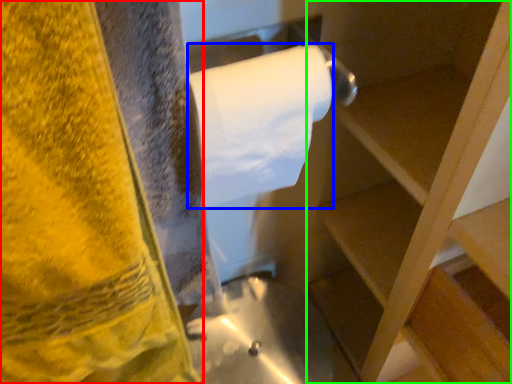
Question: Estimate the real-world distances between objects in this image. Which object is closer to towel (highlighted by a red box), toilet paper (highlighted by a blue box) or shelf (highlighted by a green box)?

Choices:
 (A) toilet paper
 (B) shelf

Answer: (A)